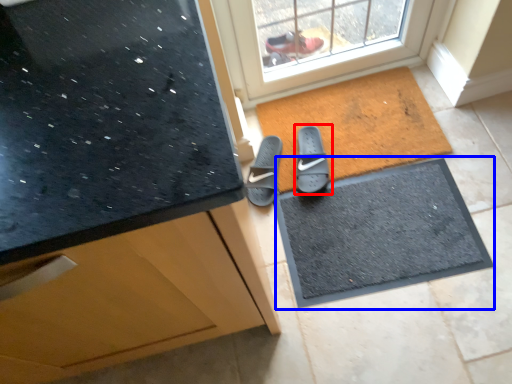
Question: Which object is further to the camera taking this photo, footwear (highlighted by a red box) or doormat (highlighted by a blue box)?

Choices:
 (A) footwear
 (B) doormat

Answer: (A)